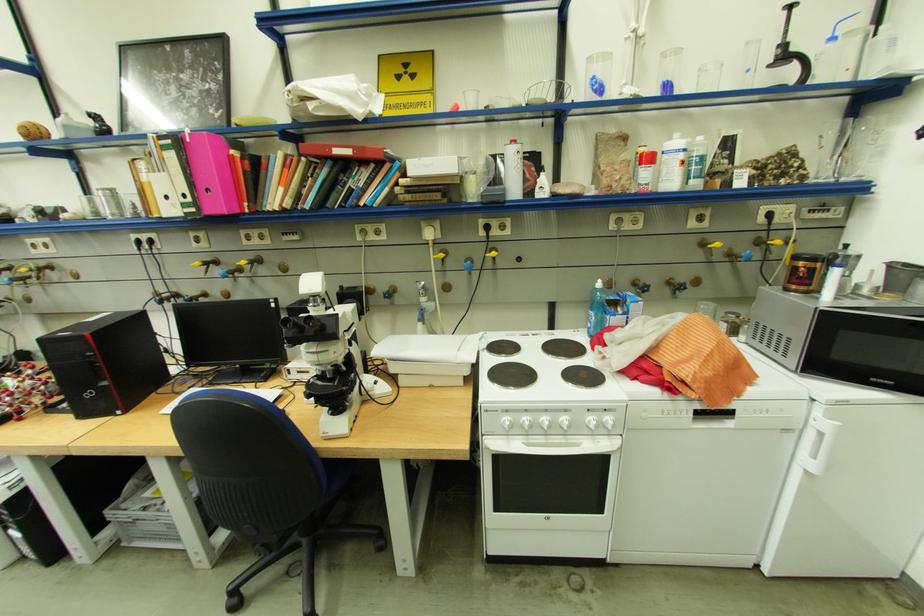
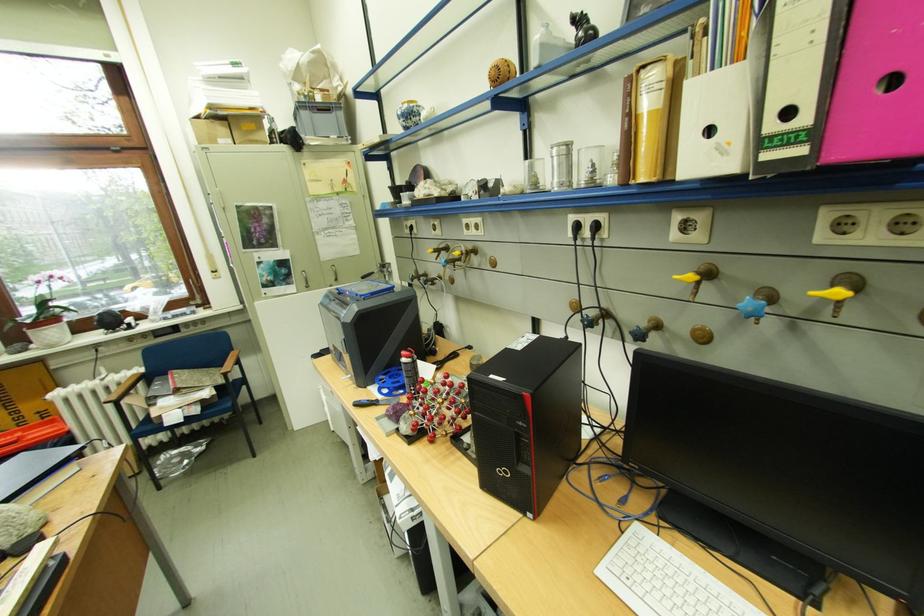
Find the pixel in the second image that matches (209,265) in the first image.

(700, 277)